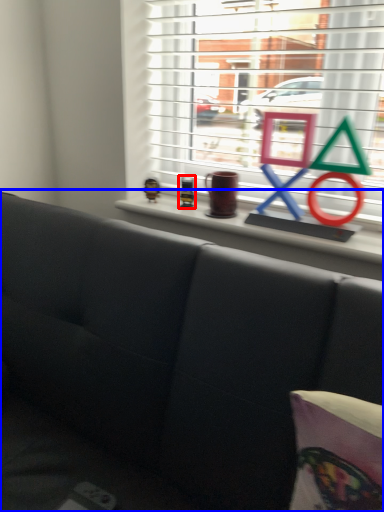
Question: Which object appears farthest to the camera in this image, toy (highlighted by a red box) or studio couch (highlighted by a blue box)?

Choices:
 (A) toy
 (B) studio couch

Answer: (A)